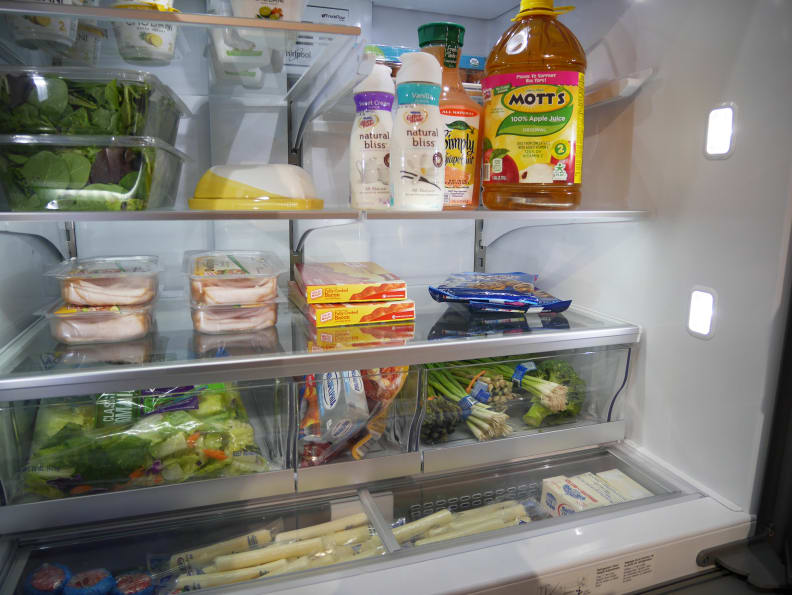
Locate an element on the screen. refrigerator interior is located at coordinates (668, 231), (440, 253), (683, 101), (252, 130).